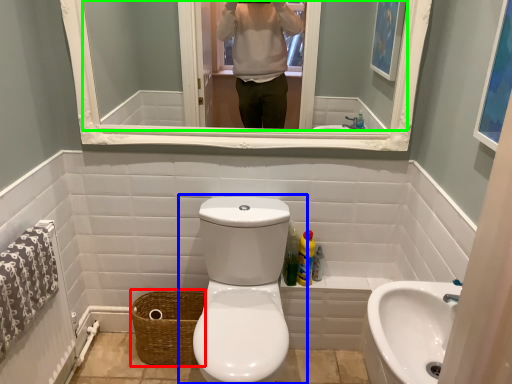
Question: Which object is the farthest from basket (highlighted by a red box)? Choose among these: toilet (highlighted by a blue box) or mirror (highlighted by a green box).

Choices:
 (A) toilet
 (B) mirror

Answer: (B)